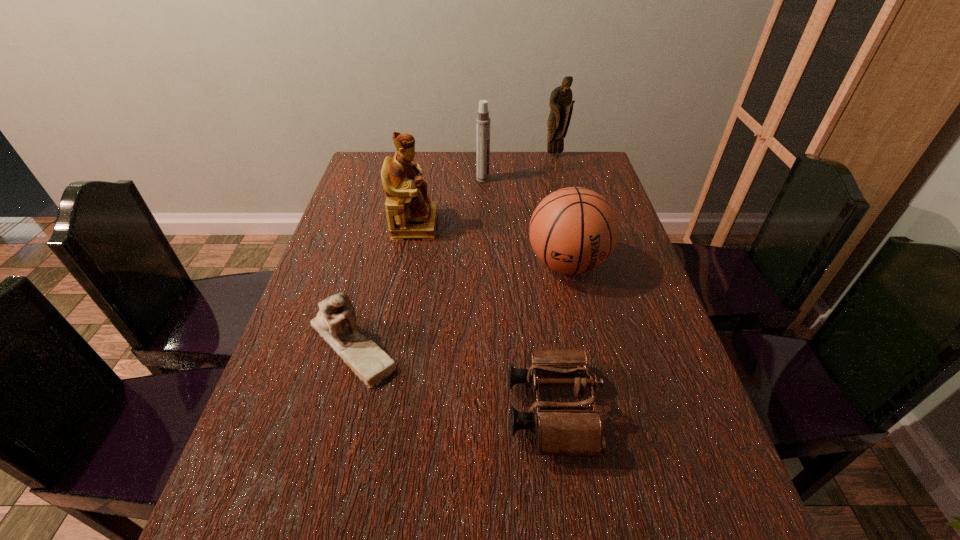
What are the coordinates of `figurine that is at the right edge` in the screenshot? It's located at (561, 104).

What are the coordinates of `basketball present at the right edge` in the screenshot? It's located at (574, 230).

You are a GUI agent. You are given a task and a screenshot of the screen. Output one action in this format:
    pyautogui.click(x=<x>, y=<y>)
    Task: Click on the object at the far right corner
    This screenshot has height=540, width=960.
    Given the screenshot: What is the action you would take?
    pyautogui.click(x=561, y=104)

This screenshot has height=540, width=960. Identify the location of free region at the far edge of the desktop. (547, 170).

I want to click on free space at the left edge of the desktop, so click(x=363, y=313).

Locate an element on the screen. Image resolution: width=960 pixels, height=540 pixels. free space at the right edge of the desktop is located at coordinates tap(623, 232).

Where is `vacant region at the far left corner of the desktop`? Image resolution: width=960 pixels, height=540 pixels. vacant region at the far left corner of the desktop is located at coordinates (396, 152).

I want to click on blank region between the fifth nearest object and the third shortest object, so click(525, 221).

Where is `vacant space that is in between the basketball and the second farthest figurine`? vacant space that is in between the basketball and the second farthest figurine is located at coordinates (491, 244).

Where is `vacant space that's between the third object from left to right and the nearest figurine`? Image resolution: width=960 pixels, height=540 pixels. vacant space that's between the third object from left to right and the nearest figurine is located at coordinates (418, 261).